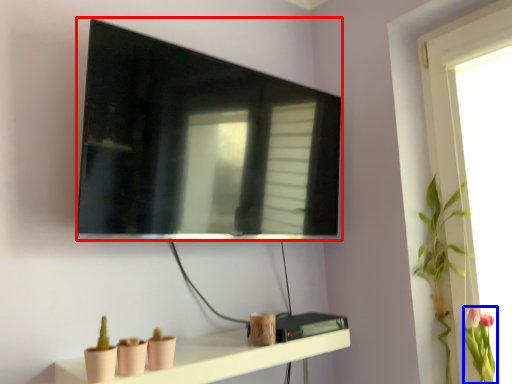
Question: Which object is further to the camera taking this photo, television (highlighted by a red box) or floral arrangement (highlighted by a blue box)?

Choices:
 (A) television
 (B) floral arrangement

Answer: (B)